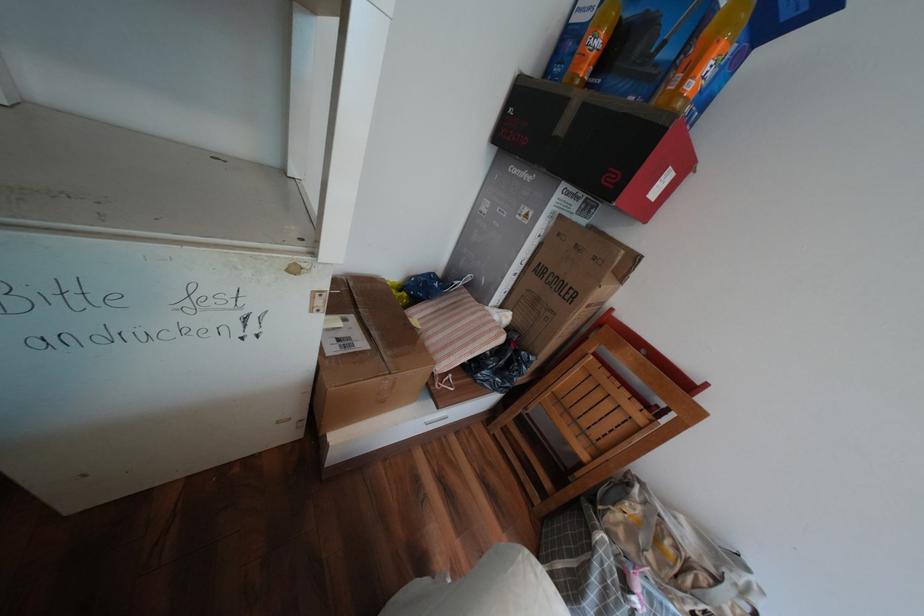
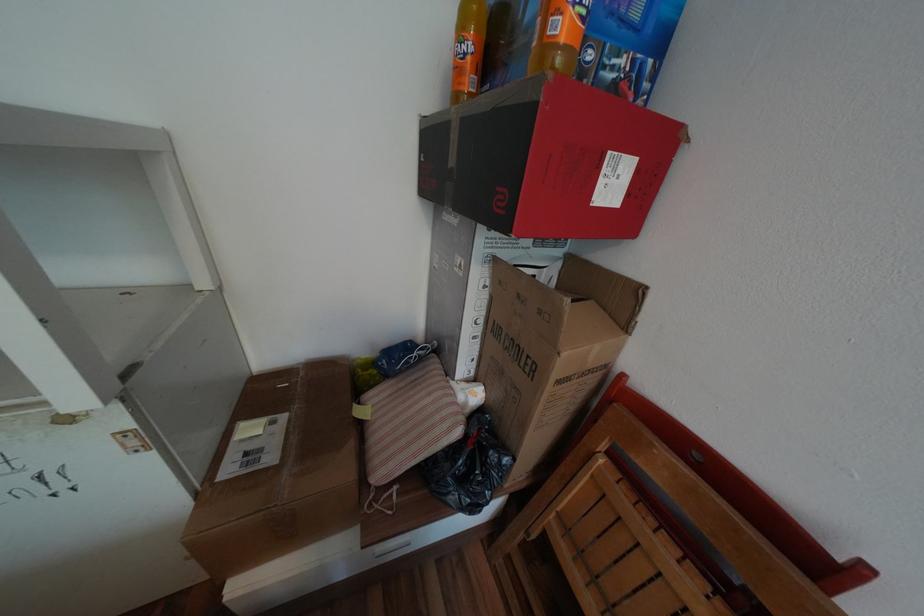
Where in the second image is the point corresponding to the point at 699,87 from the first image?

(569, 26)